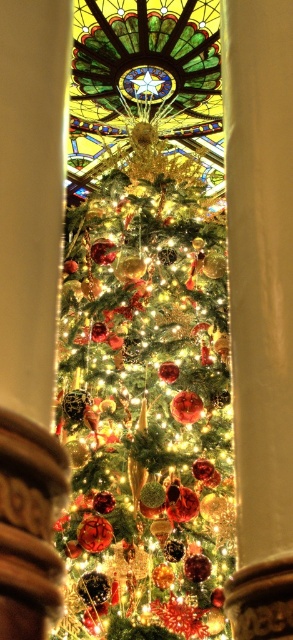
Question: Which point appears closest to the camera in this image?

Choices:
 (A) (108, 109)
 (B) (218, 371)

Answer: (B)

Question: Does glossy glass ornaments at center have a smaller size compared to stained glass at center?

Choices:
 (A) no
 (B) yes

Answer: (A)

Question: Does glossy glass ornaments at center appear on the left side of stained glass at center?

Choices:
 (A) yes
 (B) no

Answer: (B)

Question: Is glossy glass ornaments at center to the right of stained glass at center from the viewer's perspective?

Choices:
 (A) no
 (B) yes

Answer: (B)

Question: Which point is farther from the camera taking this photo?

Choices:
 (A) (118, 536)
 (B) (188, 72)

Answer: (B)

Question: Which of the following is the farthest from the observer?

Choices:
 (A) (108, 72)
 (B) (157, 614)

Answer: (A)